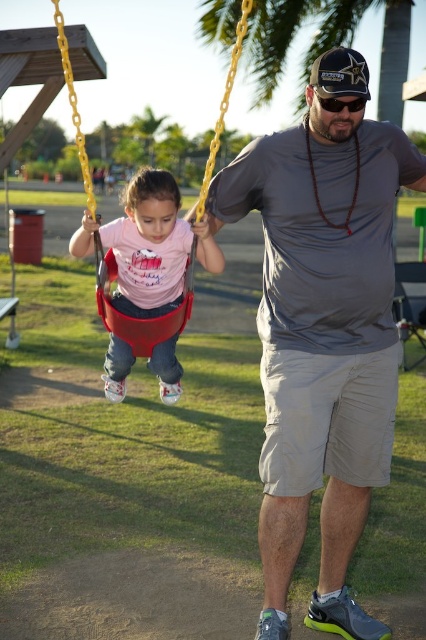
Between red plastic swing at left and black plastic goggles at upper center, which one has more height?

red plastic swing at left is taller.

Is point (245, 29) closer to camera compared to point (359, 104)?

No.

Who is more distant from viewer, (x=100, y=275) or (x=353, y=106)?

The point (x=100, y=275) is behind.

Where is `red plastic swing at left`? The height and width of the screenshot is (640, 426). red plastic swing at left is located at coordinates (140, 317).

Is gray fabric shirt at center to the left of red plastic swing at left from the viewer's perspective?

Incorrect, gray fabric shirt at center is not on the left side of red plastic swing at left.

Which is behind, point (334, 195) or point (109, 298)?

Point (109, 298)

Between point (351, 616) and point (83, 172), which one is positioned in front?

Point (351, 616)

What are the coordinates of `gray fabric shirt at center` in the screenshot? It's located at (322, 330).

Is gray fabric shirt at center to the left of matte plastic swing at left from the viewer's perspective?

No, gray fabric shirt at center is not to the left of matte plastic swing at left.

Can you confirm if gray fabric shirt at center is positioned to the right of matte plastic swing at left?

Yes, gray fabric shirt at center is to the right of matte plastic swing at left.

Does point (351, 499) lie behind point (152, 241)?

No.

Where is `gray fabric shirt at center`? This screenshot has width=426, height=640. gray fabric shirt at center is located at coordinates (322, 330).